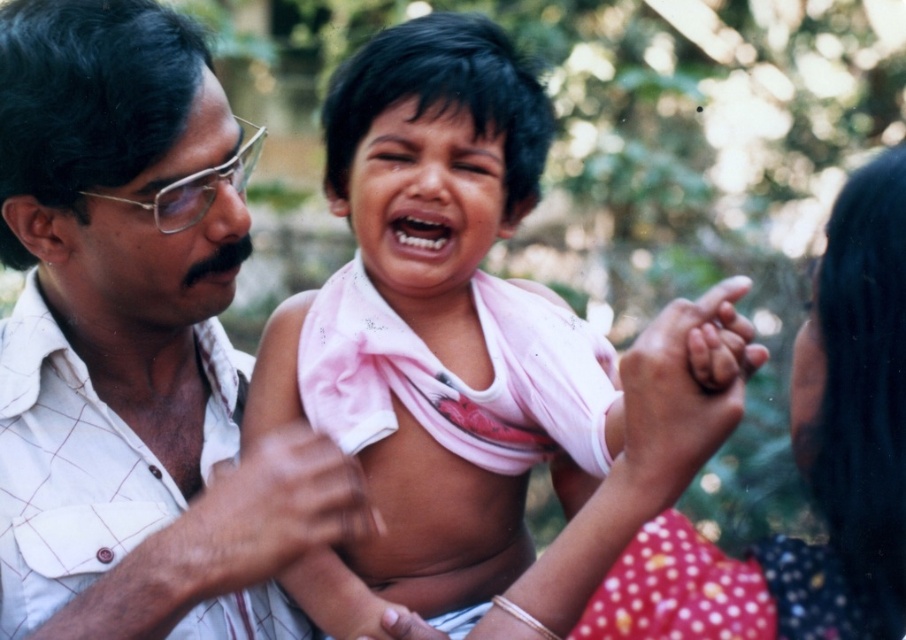
You are a photographer trying to capture a candid shot of the white checkered shirt at left and the pink cotton shirt at center. Since you want both subjects in focus, you need to know their positions relative to each other. Which shirt is positioned further to the left in the frame?

The white checkered shirt at left is positioned to the left of the pink cotton shirt at center, so it is further to the left in the frame.

You are a photographer trying to capture a group photo of the white checkered shirt at left and the pink cotton shirt at center. If you want to ensure both shirts are fully visible in the frame, which shirt should you focus on first?

The white checkered shirt at left is taller than the pink cotton shirt at center, so you should focus on the white checkered shirt at left first to ensure it fits properly in the frame.

From the picture: You are a photographer trying to capture a closeup of the child in the center. The pink fabric cloth at center and the pink cotton shirt at center are both in the frame. Which one should you focus on to ensure the child is in focus?

The photographer should focus on the pink cotton shirt at center because it is closer to the child than the pink fabric cloth at center, which is taller and thus farther away.